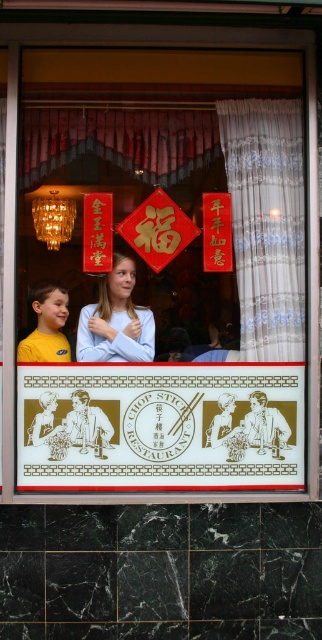
Question: Which is nearer to the gold paper sign at center?

Choices:
 (A) white lace curtain at upper right
 (B) light blue fabric at center
 (C) red paper sign at upper center

Answer: (B)

Question: Is white lace curtain at upper right positioned before gold paper sign at upper center?

Choices:
 (A) yes
 (B) no

Answer: (B)

Question: Which point is farther to the camera?

Choices:
 (A) gold paper sign at center
 (B) red paper sign at upper center
 (C) gold paper sign at upper center
 (D) yellow shirt at left

Answer: (B)

Question: Does light blue fabric at center have a smaller size compared to yellow shirt at left?

Choices:
 (A) yes
 (B) no

Answer: (B)

Question: Which point is farther to the camera?

Choices:
 (A) yellow shirt at left
 (B) white lace curtain at upper right
 (C) light blue fabric at center

Answer: (C)

Question: Is gold paper sign at upper center positioned at the back of red paper sign at upper center?

Choices:
 (A) no
 (B) yes

Answer: (A)